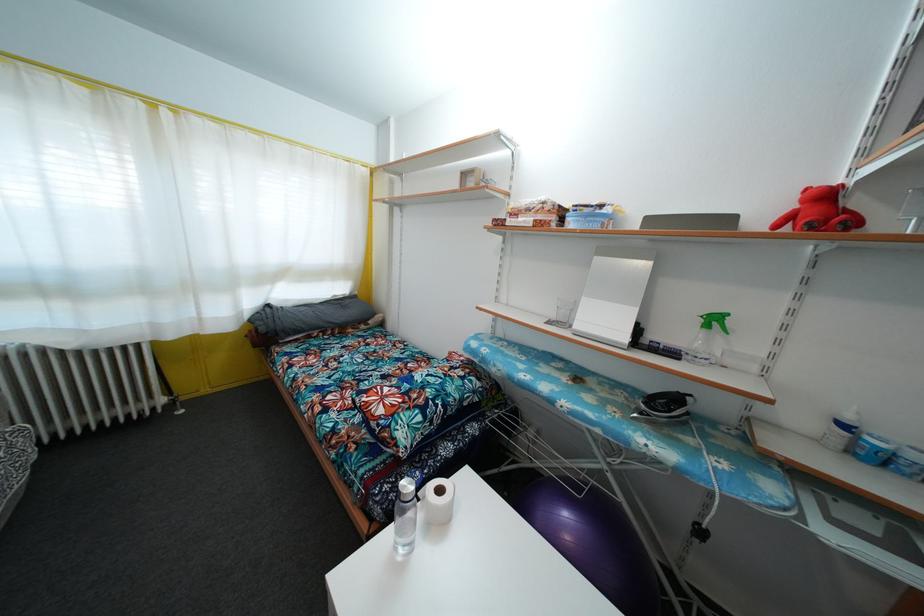
At what (x,y) coordinates should I click in order to perform the action: click on red teddy bear. Please return your answer as a coordinate pair (x, y). The image size is (924, 616). Looking at the image, I should click on (821, 212).